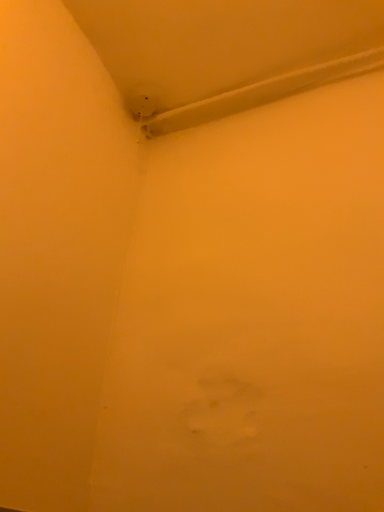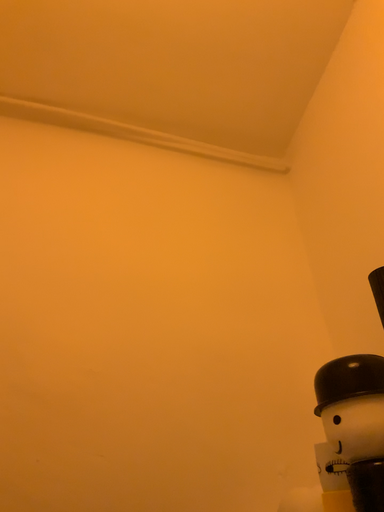
Question: Which way did the camera rotate in the video?

Choices:
 (A) rotated downward
 (B) rotated upward

Answer: (A)